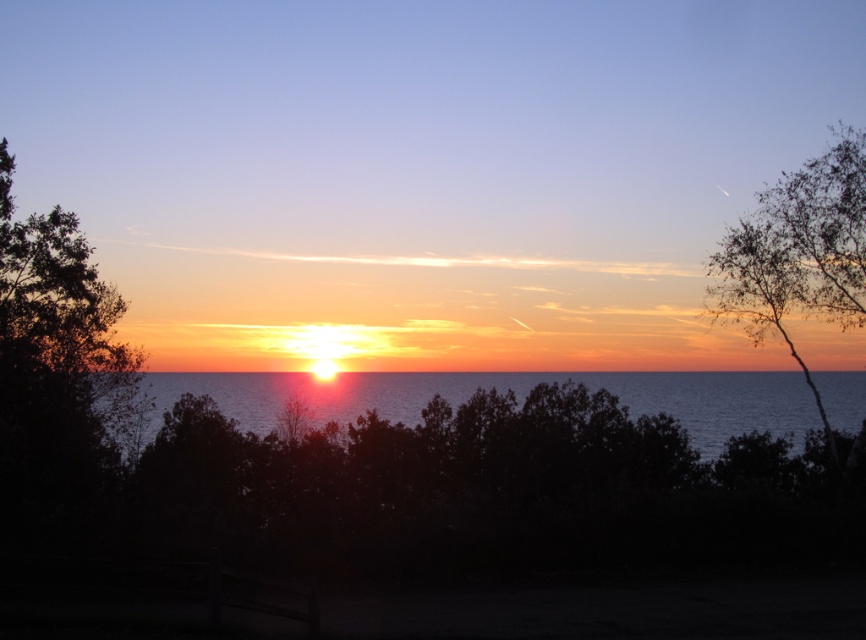
Does shiny blue water at center appear under bare branches at right?

Correct, shiny blue water at center is located below bare branches at right.

Can you confirm if shiny blue water at center is taller than bare branches at right?

No, shiny blue water at center is not taller than bare branches at right.

Does point (273, 422) come behind point (863, 184)?

Yes.

The height and width of the screenshot is (640, 866). In order to click on shiny blue water at center in this screenshot , I will do `click(488, 388)`.